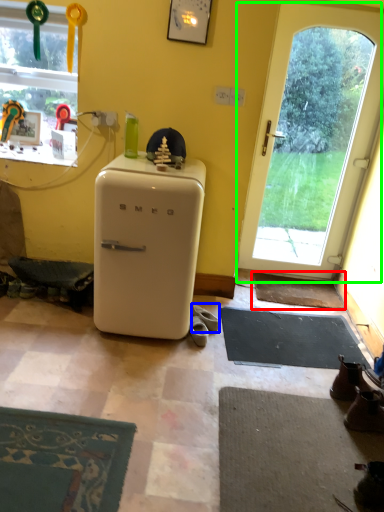
Question: Considering the real-world distances, which object is farthest from doormat (highlighted by a red box)? footwear (highlighted by a blue box) or door (highlighted by a green box)?

Choices:
 (A) footwear
 (B) door

Answer: (A)